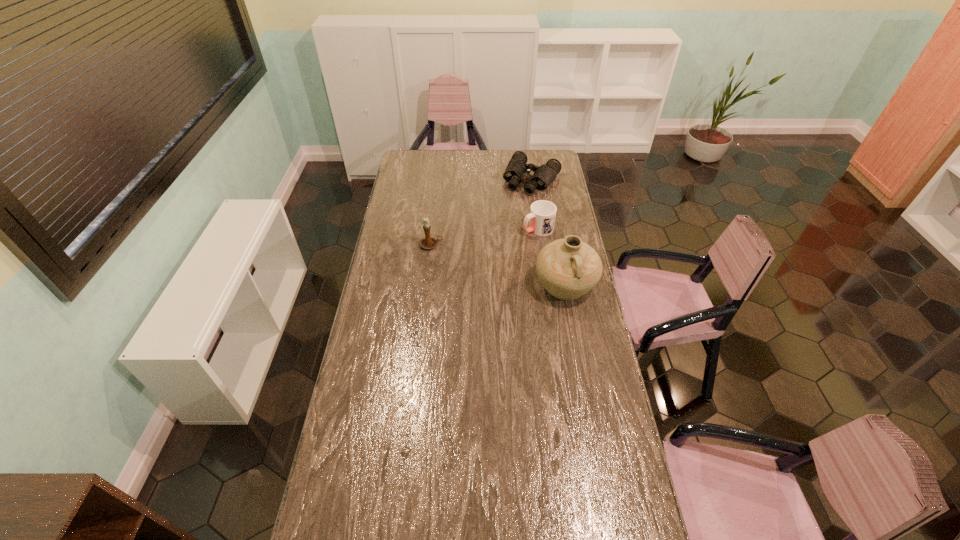
Where is `object situated at the far right corner`? This screenshot has height=540, width=960. object situated at the far right corner is located at coordinates (517, 171).

Image resolution: width=960 pixels, height=540 pixels. Identify the location of blank area at the far edge. (472, 154).

This screenshot has width=960, height=540. I want to click on free space at the near edge of the desktop, so click(500, 511).

In the image, there is a desktop. Identify the location of vacant space at the left edge. (365, 410).

Identify the location of free space at the right edge. This screenshot has height=540, width=960. (573, 348).

At what (x,y) coordinates should I click in order to perform the action: click on free point between the second shortest object and the leftmost object. Please return your answer as a coordinate pair (x, y). The image size is (960, 540). Looking at the image, I should click on (485, 237).

The image size is (960, 540). In order to click on unoccupied position between the candle holder and the shortest object in this screenshot , I will do `click(482, 212)`.

Where is `blank region between the binoculars and the second tallest object`? This screenshot has width=960, height=540. blank region between the binoculars and the second tallest object is located at coordinates (482, 212).

Where is `free space that is in between the candle holder and the nearest object`? The height and width of the screenshot is (540, 960). free space that is in between the candle holder and the nearest object is located at coordinates (498, 266).

Image resolution: width=960 pixels, height=540 pixels. What are the coordinates of `unoccupied area between the pottery and the second tallest object` in the screenshot? It's located at (498, 266).